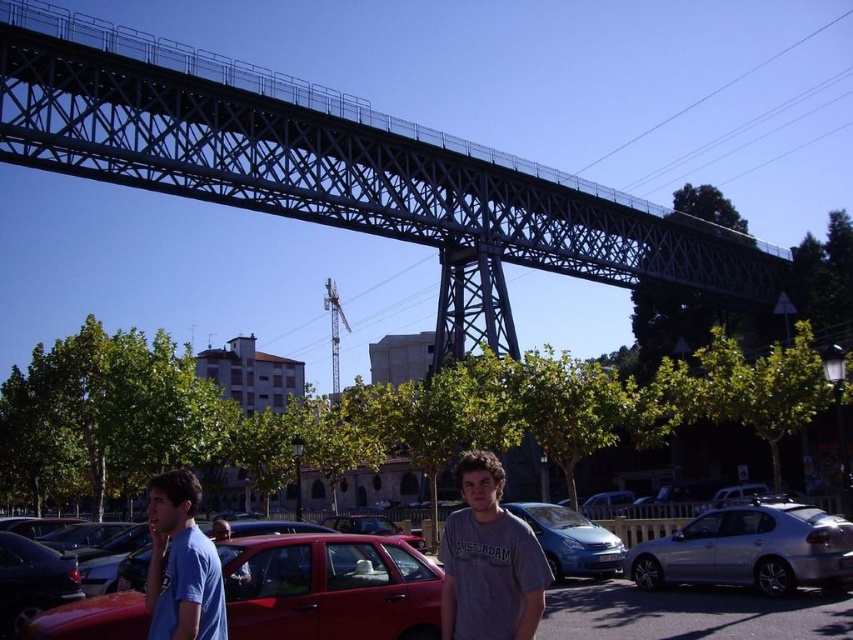
Question: Is gray cotton t-shirt at center closer to the viewer compared to blue t-shirt at lower left?

Choices:
 (A) no
 (B) yes

Answer: (B)

Question: Is blue cotton shirt at lower left thinner than matte blue van at center?

Choices:
 (A) no
 (B) yes

Answer: (B)

Question: Which point is closer to the camera?

Choices:
 (A) (558, 634)
 (B) (672, 576)
 (C) (534, 525)
 (D) (54, 12)

Answer: (D)

Question: Which point is closer to the camera taking this photo?

Choices:
 (A) (592, 560)
 (B) (254, 592)

Answer: (B)

Question: Which of the following is the closest to the observer?

Choices:
 (A) silver metallic car at lower right
 (B) matte red car at lower center
 (C) matte blue van at center

Answer: (B)

Question: Is gray cotton t-shirt at center positioned before matte blue van at center?

Choices:
 (A) yes
 (B) no

Answer: (A)